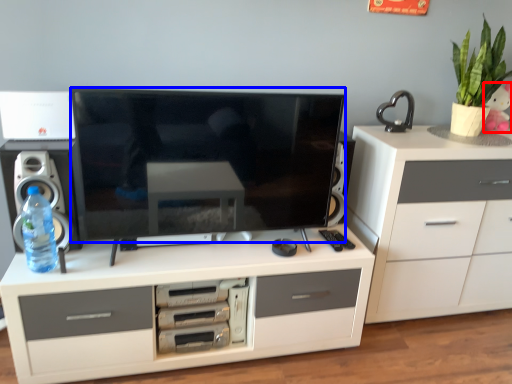
Question: Which point is closer to the camera, toy (highlighted by a red box) or television (highlighted by a blue box)?

Choices:
 (A) toy
 (B) television

Answer: (B)